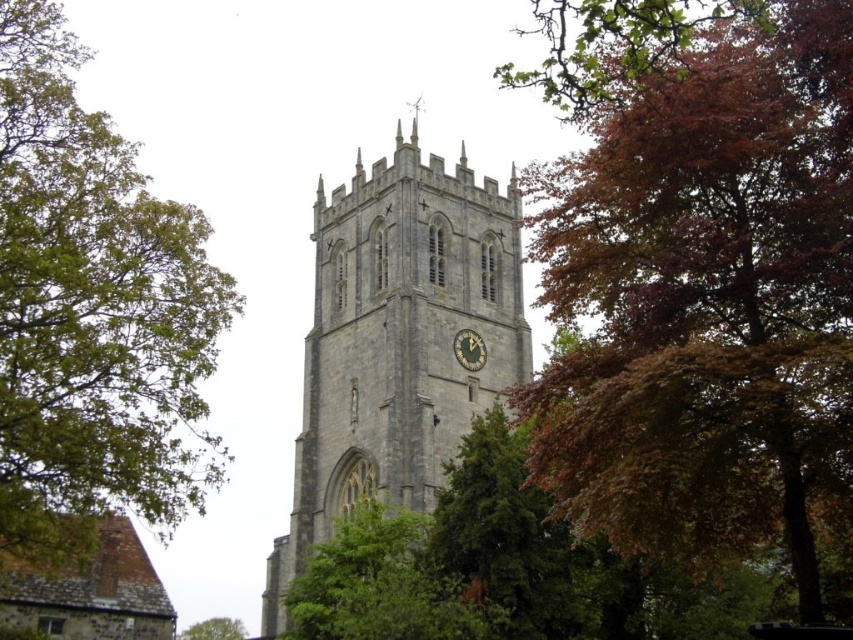
Question: Which object is closer to the camera taking this photo?

Choices:
 (A) dark gray stone clock at center
 (B) green leafy tree at left
 (C) autumn leaves at upper right
 (D) green leafy tree at center

Answer: (C)

Question: Can you confirm if green leafy tree at left is positioned above green leafy tree at center?

Choices:
 (A) no
 (B) yes

Answer: (B)

Question: Which of these objects is positioned closest to the gray stone church tower at center?

Choices:
 (A) green leafy tree at center
 (B) autumn leaves at upper right
 (C) dark gray stone clock at center

Answer: (C)

Question: Is gray stone church tower at center to the left of dark gray stone clock at center from the viewer's perspective?

Choices:
 (A) yes
 (B) no

Answer: (A)

Question: Is gray stone church tower at center above dark gray stone clock at center?

Choices:
 (A) yes
 (B) no

Answer: (B)

Question: Which of the following is the farthest from the observer?

Choices:
 (A) (219, 636)
 (B) (177, 481)
 (C) (463, 328)

Answer: (A)